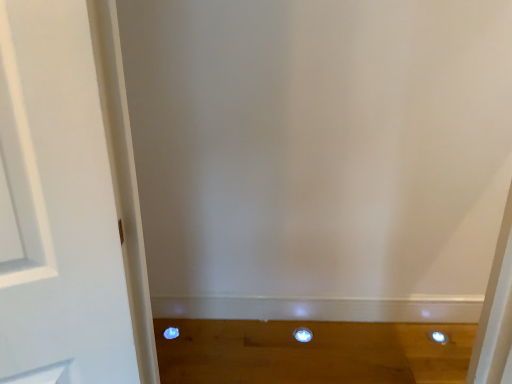
Question: Considering the relative sizes of white glossy dot at center, acting as the second dot starting from the left, and matte blue dot at lower left, positioned as the 1th dot in left-to-right order, in the image provided, is white glossy dot at center, acting as the second dot starting from the left, thinner than matte blue dot at lower left, positioned as the 1th dot in left-to-right order,?

Choices:
 (A) no
 (B) yes

Answer: (A)

Question: Does white glossy dot at center, acting as the second dot starting from the left, contain matte blue dot at lower left, the second dot in the right-to-left sequence?

Choices:
 (A) yes
 (B) no

Answer: (B)

Question: Does white glossy dot at center, which appears as the 1th dot when viewed from the right, turn towards matte blue dot at lower left, the second dot in the right-to-left sequence?

Choices:
 (A) yes
 (B) no

Answer: (B)

Question: Considering the relative sizes of white glossy dot at center, acting as the second dot starting from the left, and matte blue dot at lower left, positioned as the 1th dot in left-to-right order, in the image provided, is white glossy dot at center, acting as the second dot starting from the left, shorter than matte blue dot at lower left, positioned as the 1th dot in left-to-right order,?

Choices:
 (A) yes
 (B) no

Answer: (B)

Question: Does white glossy dot at center, acting as the second dot starting from the left, come in front of matte blue dot at lower left, the second dot in the right-to-left sequence?

Choices:
 (A) yes
 (B) no

Answer: (A)

Question: Can you confirm if white glossy dot at center, which appears as the 1th dot when viewed from the right, is smaller than matte blue dot at lower left, the second dot in the right-to-left sequence?

Choices:
 (A) no
 (B) yes

Answer: (A)

Question: Considering the relative positions of matte blue dot at lower left, positioned as the 1th dot in left-to-right order, and white glossy dot at center, acting as the second dot starting from the left, in the image provided, is matte blue dot at lower left, positioned as the 1th dot in left-to-right order, to the left of white glossy dot at center, acting as the second dot starting from the left, from the viewer's perspective?

Choices:
 (A) no
 (B) yes

Answer: (B)

Question: Considering the relative sizes of matte blue dot at lower left, positioned as the 1th dot in left-to-right order, and white glossy dot at center, which appears as the 1th dot when viewed from the right, in the image provided, is matte blue dot at lower left, positioned as the 1th dot in left-to-right order, taller than white glossy dot at center, which appears as the 1th dot when viewed from the right,?

Choices:
 (A) yes
 (B) no

Answer: (B)

Question: Is matte blue dot at lower left, the second dot in the right-to-left sequence, at the right side of white glossy dot at center, which appears as the 1th dot when viewed from the right?

Choices:
 (A) no
 (B) yes

Answer: (A)

Question: Would you consider matte blue dot at lower left, the second dot in the right-to-left sequence, to be distant from white glossy dot at center, acting as the second dot starting from the left?

Choices:
 (A) no
 (B) yes

Answer: (A)

Question: Considering the relative sizes of matte blue dot at lower left, positioned as the 1th dot in left-to-right order, and white glossy dot at center, acting as the second dot starting from the left, in the image provided, is matte blue dot at lower left, positioned as the 1th dot in left-to-right order, wider than white glossy dot at center, acting as the second dot starting from the left,?

Choices:
 (A) no
 (B) yes

Answer: (A)

Question: Does matte blue dot at lower left, positioned as the 1th dot in left-to-right order, have a lesser width compared to white glossy dot at center, which appears as the 1th dot when viewed from the right?

Choices:
 (A) no
 (B) yes

Answer: (B)

Question: Considering the positions of white glossy dot at center, acting as the second dot starting from the left, and matte blue dot at lower left, the second dot in the right-to-left sequence, in the image, is white glossy dot at center, acting as the second dot starting from the left, wider or thinner than matte blue dot at lower left, the second dot in the right-to-left sequence,?

Choices:
 (A) wide
 (B) thin

Answer: (A)